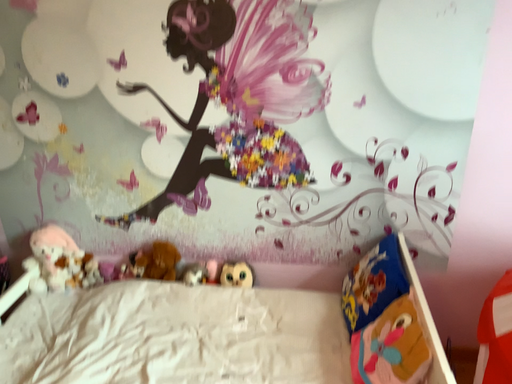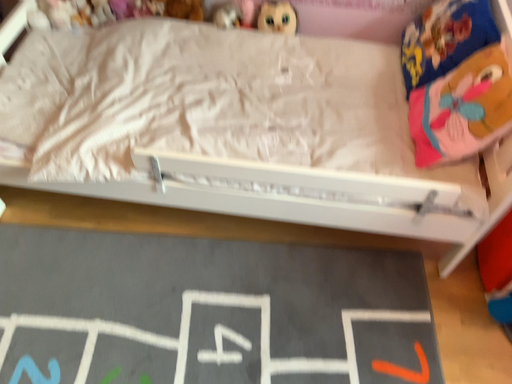
Question: Which way did the camera rotate in the video?

Choices:
 (A) rotated downward
 (B) rotated upward

Answer: (A)